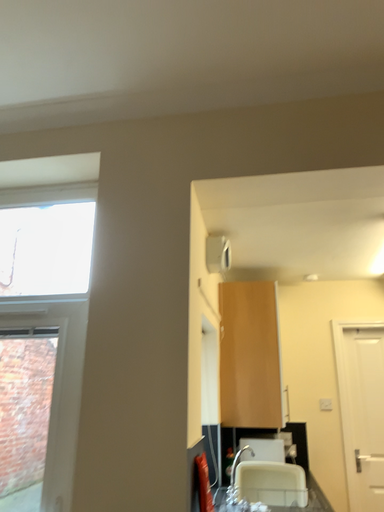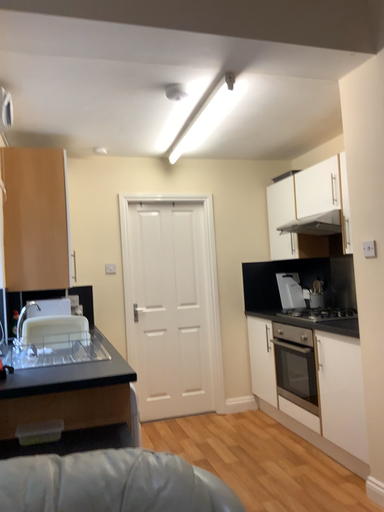
Question: How did the camera likely rotate when shooting the video?

Choices:
 (A) rotated right
 (B) rotated left

Answer: (A)